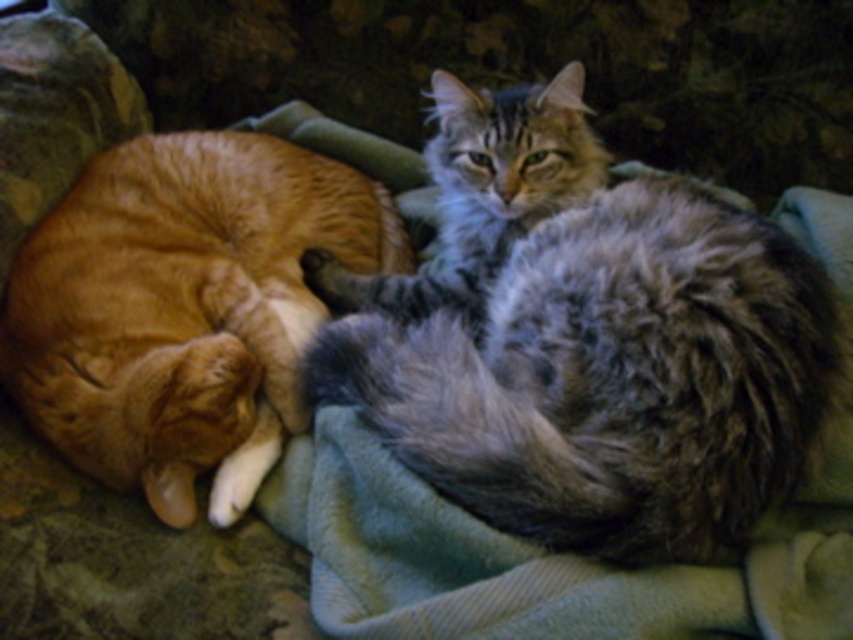
Question: Which object is farther from the camera taking this photo?

Choices:
 (A) gray fluffy cat at center
 (B) orange fur cat at left

Answer: (B)

Question: Is gray fluffy cat at center to the left of orange fur cat at left from the viewer's perspective?

Choices:
 (A) no
 (B) yes

Answer: (A)

Question: Is gray fluffy cat at center bigger than orange fur cat at left?

Choices:
 (A) no
 (B) yes

Answer: (B)

Question: Can you confirm if gray fluffy cat at center is positioned to the right of orange fur cat at left?

Choices:
 (A) no
 (B) yes

Answer: (B)

Question: Among these points, which one is nearest to the camera?

Choices:
 (A) (126, 237)
 (B) (785, 486)

Answer: (B)